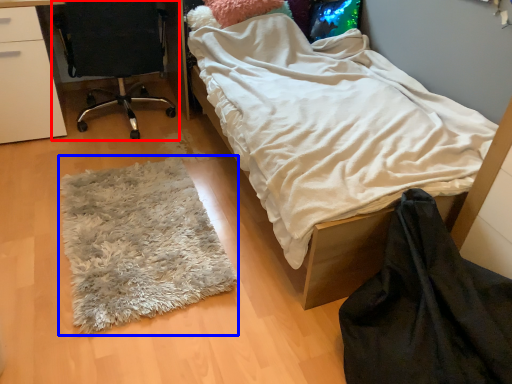
Question: Which point is further to the camera, chair (highlighted by a red box) or mat (highlighted by a blue box)?

Choices:
 (A) chair
 (B) mat

Answer: (A)